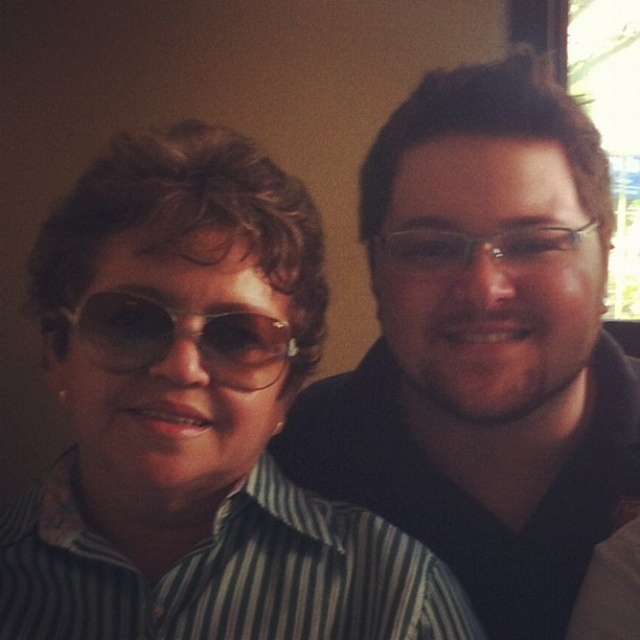
Can you confirm if matte black shirt at right is thinner than sunglasses at left?

No, matte black shirt at right is not thinner than sunglasses at left.

Is matte black shirt at right taller than sunglasses at left?

Yes, matte black shirt at right is taller than sunglasses at left.

Describe the element at coordinates (484, 348) in the screenshot. The height and width of the screenshot is (640, 640). I see `matte black shirt at right` at that location.

Locate an element on the screen. This screenshot has height=640, width=640. matte black shirt at right is located at coordinates (484, 348).

Who is higher up, matte black sunglasses at upper left or matte black shirt at right?

matte black shirt at right is higher up.

Which is behind, point (166, 540) or point (541, 141)?

Point (541, 141)

Between point (250, 204) and point (435, 248), which one is positioned behind?

The point (435, 248) is more distant.

Find the location of a particular element. The width and height of the screenshot is (640, 640). matte black sunglasses at upper left is located at coordinates (195, 419).

Can you confirm if matte black sunglasses at upper left is wider than sunglasses at left?

Indeed, matte black sunglasses at upper left has a greater width compared to sunglasses at left.

Between matte black sunglasses at upper left and sunglasses at left, which one appears on the left side from the viewer's perspective?

matte black sunglasses at upper left

Measure the distance between point (291, 374) and camera.

Point (291, 374) is 52.18 centimeters from camera.

Where is `matte black sunglasses at upper left`? matte black sunglasses at upper left is located at coordinates (195, 419).